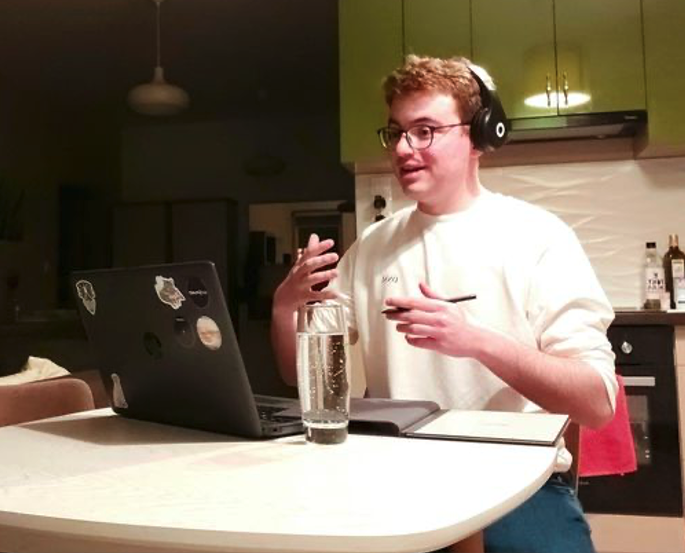
The height and width of the screenshot is (553, 685). I want to click on glass, so click(x=329, y=399).